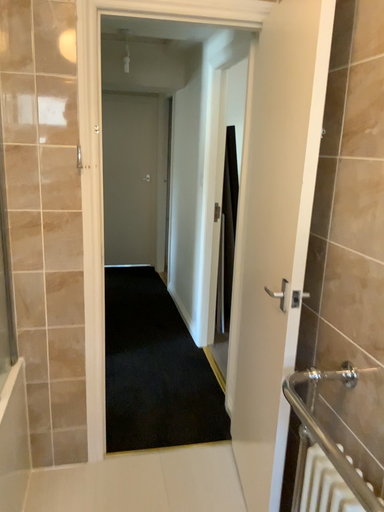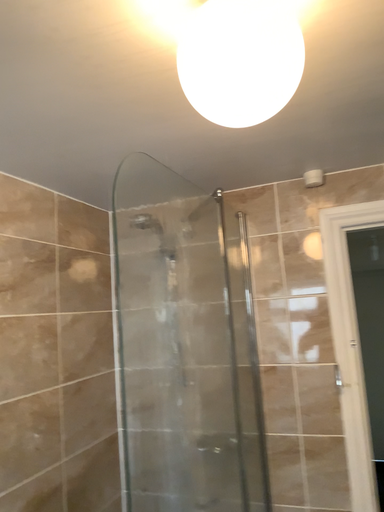
Question: How did the camera likely rotate when shooting the video?

Choices:
 (A) rotated right
 (B) rotated left

Answer: (B)